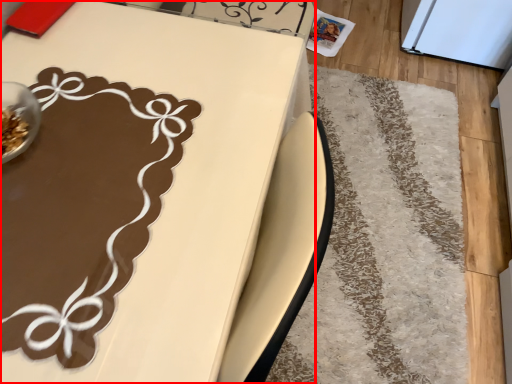
Question: From the image's perspective, where is table (annotated by the red box) located in relation to mat in the image?

Choices:
 (A) below
 (B) above

Answer: (A)